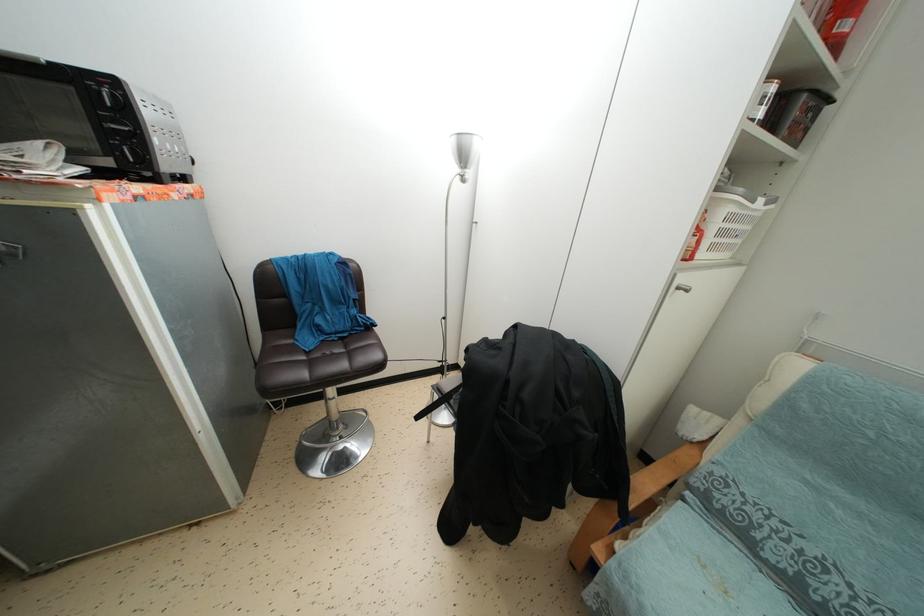
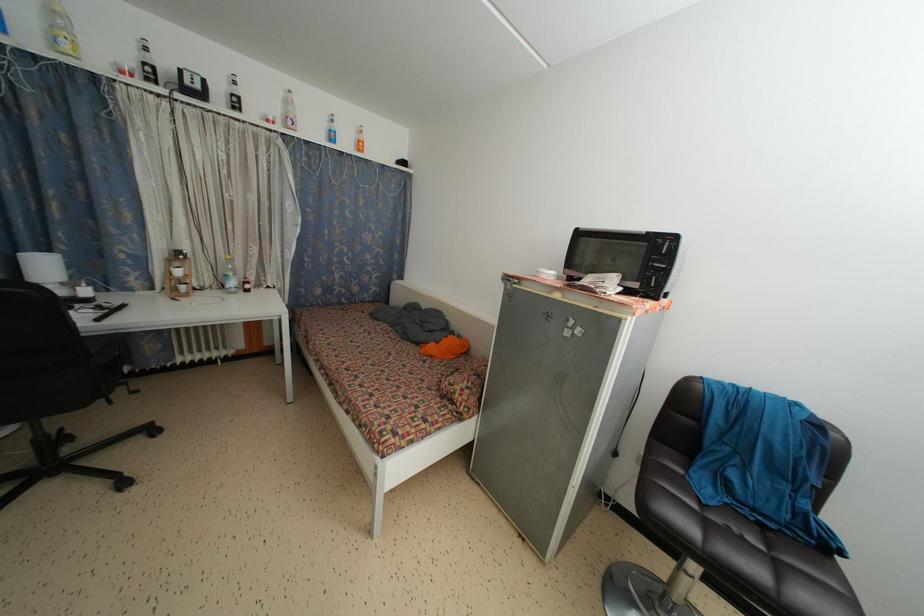
In the second image, find the point that corresponds to (346,344) in the first image.

(767, 532)